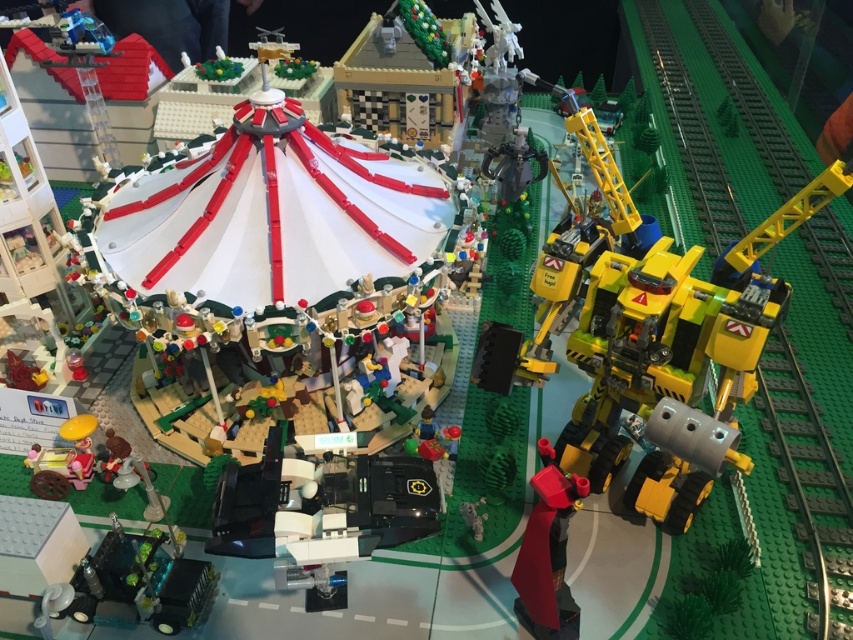
You are a small LEGO figure standing on the green plastic train track at right. You want to jump to the smooth red cape at center. Is the jump possible?

The green plastic train track at right has a greater height compared to smooth red cape at center, so yes, the jump is possible because the starting point is higher.